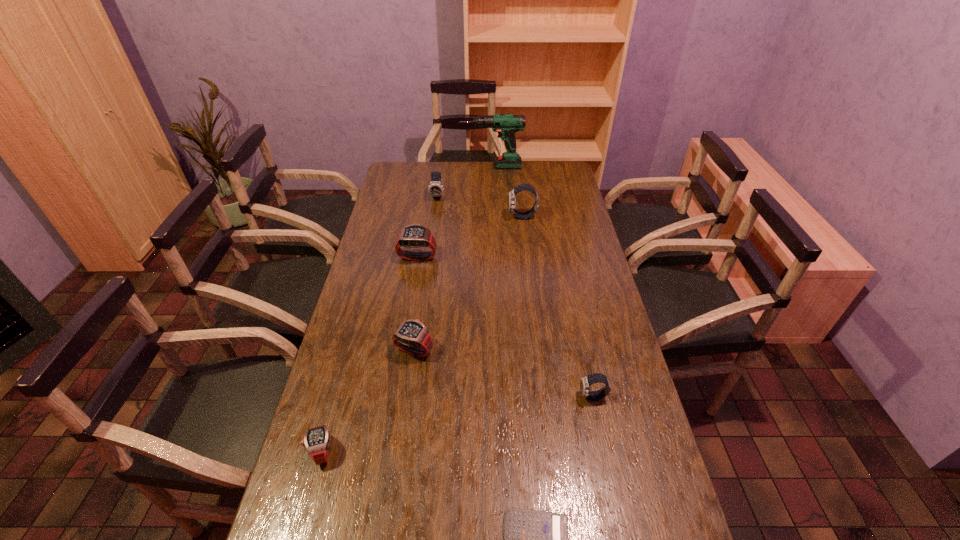
Where is `free location at the left edge of the desktop`? free location at the left edge of the desktop is located at coordinates (368, 419).

Where is `free location at the right edge`? The width and height of the screenshot is (960, 540). free location at the right edge is located at coordinates (629, 442).

The width and height of the screenshot is (960, 540). I want to click on vacant area at the far left corner, so click(408, 181).

This screenshot has height=540, width=960. What are the coordinates of `vacant space that's between the nearest dark watch and the farthest dark watch` in the screenshot? It's located at (516, 296).

Find the location of `free space between the farthest watch and the second nearest red watch`. free space between the farthest watch and the second nearest red watch is located at coordinates [x=426, y=273].

Where is `vacant area between the fourth farthest watch and the second tallest object`? This screenshot has height=540, width=960. vacant area between the fourth farthest watch and the second tallest object is located at coordinates (468, 284).

This screenshot has height=540, width=960. What are the coordinates of `vacant point located between the drill and the nearest red watch` in the screenshot? It's located at (407, 309).

Image resolution: width=960 pixels, height=540 pixels. Identify the location of empty location between the leftmost dark watch and the nearest red watch. (380, 324).

At what (x,y) coordinates should I click in order to perform the action: click on free space between the second shortest object and the fifth farthest object. Please return your answer as a coordinate pair (x, y). Image resolution: width=960 pixels, height=540 pixels. Looking at the image, I should click on (368, 401).

Locate an element on the screen. This screenshot has height=540, width=960. object that ranks as the fifth closest to the second farthest red watch is located at coordinates click(522, 187).